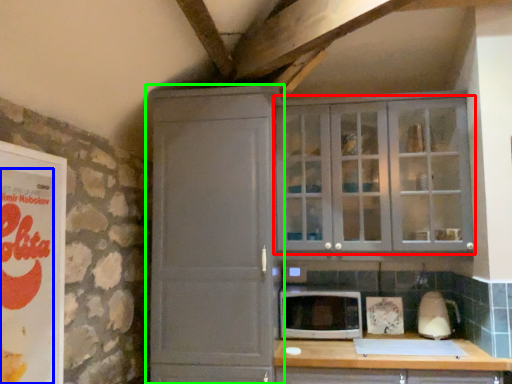
Question: Based on their relative distances, which object is nearer to cupboard (highlighted by a red box)? Choose from advertisement (highlighted by a blue box) and cupboard (highlighted by a green box).

Choices:
 (A) advertisement
 (B) cupboard

Answer: (B)